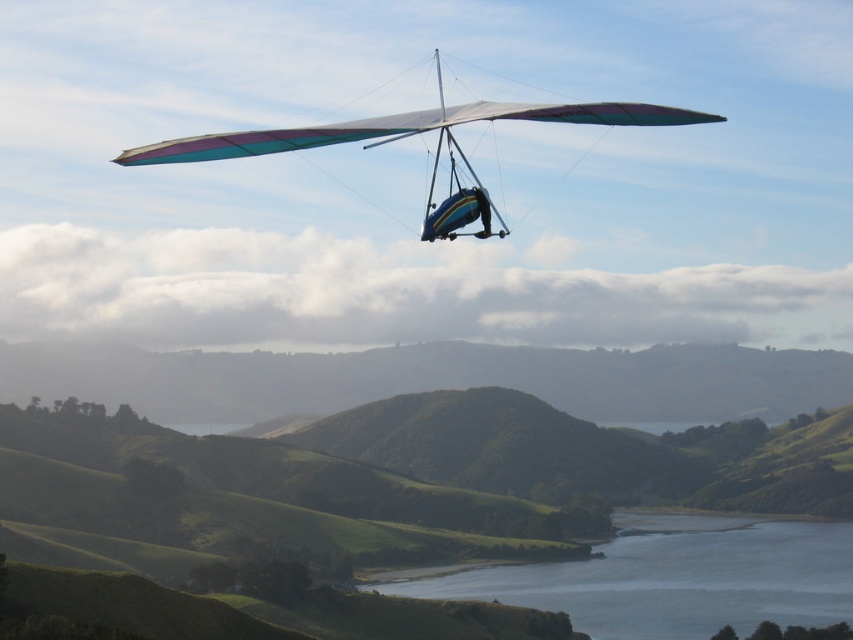
Between point (833, 595) and point (469, 172), which one is positioned in front?

Point (469, 172) is more forward.

Identify the location of smooth blue water at lower center. (670, 577).